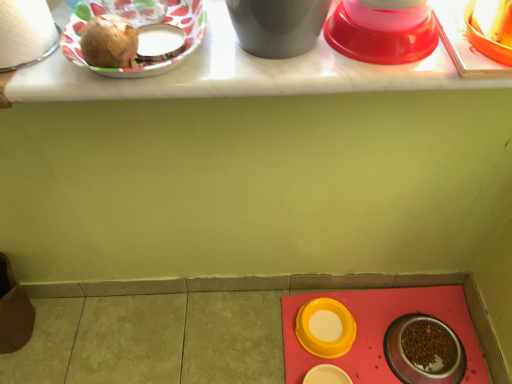
This screenshot has width=512, height=384. I want to click on empty space that is to the right of matte plastic plate at upper left, which appears as the 2th tableware when viewed from the left, so click(254, 60).